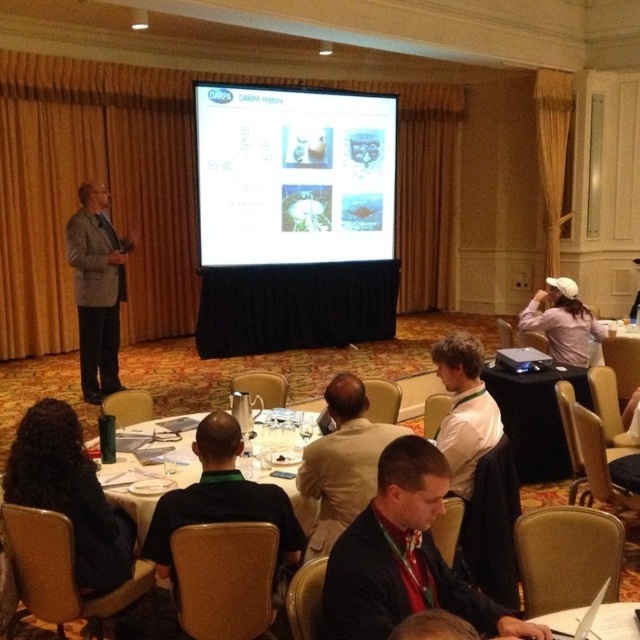
Question: Is black shirt at center positioned before black fabric projector at center?

Choices:
 (A) no
 (B) yes

Answer: (B)

Question: Is black fabric projector at center smaller than pink fabric shirt at upper right?

Choices:
 (A) yes
 (B) no

Answer: (A)

Question: Based on their relative distances, which object is farther from the dark brown suit at center?

Choices:
 (A) black fabric projector at center
 (B) dark suit at center
 (C) gray woolen blazer at center

Answer: (C)

Question: Does dark suit at center appear on the right side of white shirt at center?

Choices:
 (A) yes
 (B) no

Answer: (B)

Question: Estimate the real-world distances between objects in this image. Which object is farther from the dark suit at center?

Choices:
 (A) black shirt at center
 (B) pink fabric shirt at upper right
 (C) dark brown suit at center

Answer: (B)

Question: Among these points, which one is nearest to the camera?

Choices:
 (A) (412, 588)
 (B) (529, 323)

Answer: (A)